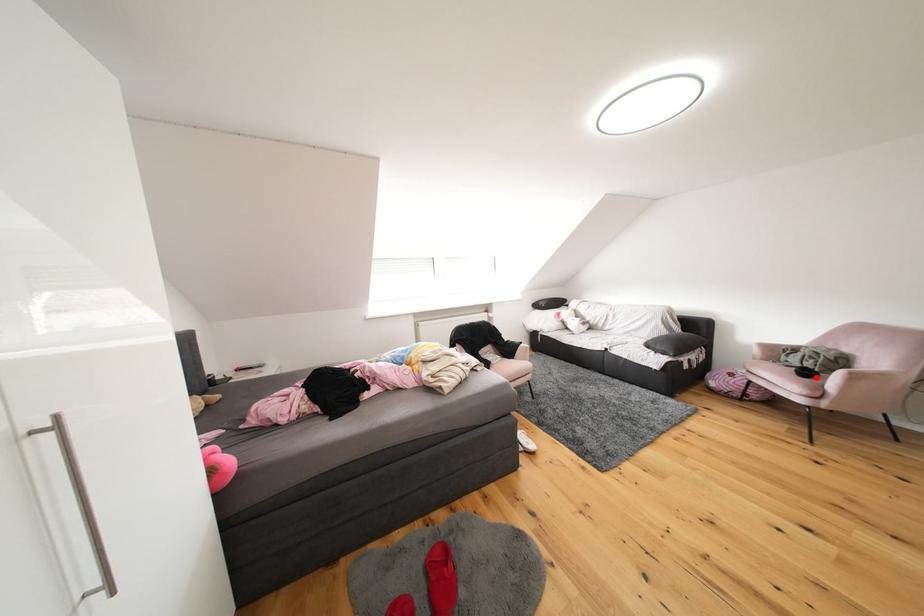
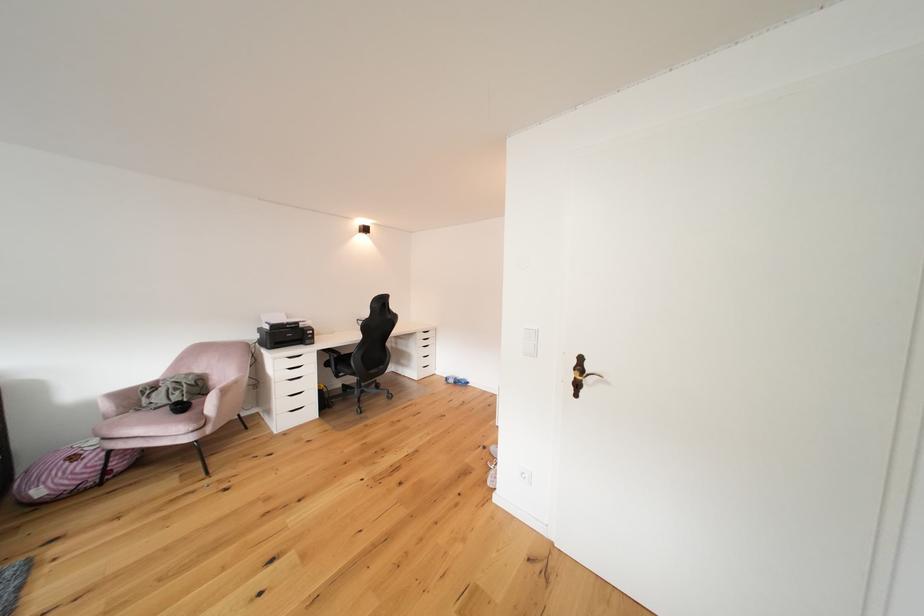
Question: I am providing you with two images of the same scene from different viewpoints. Given a red point in image1, look at the same physical point in image2. Is it:

Choices:
 (A) Closer to the viewpoint
 (B) Farther from the viewpoint

Answer: (A)